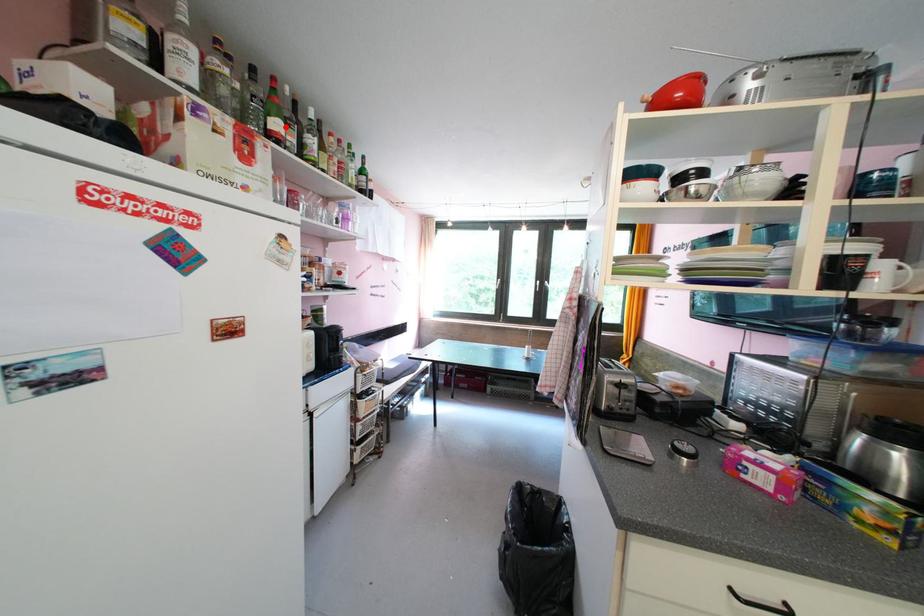
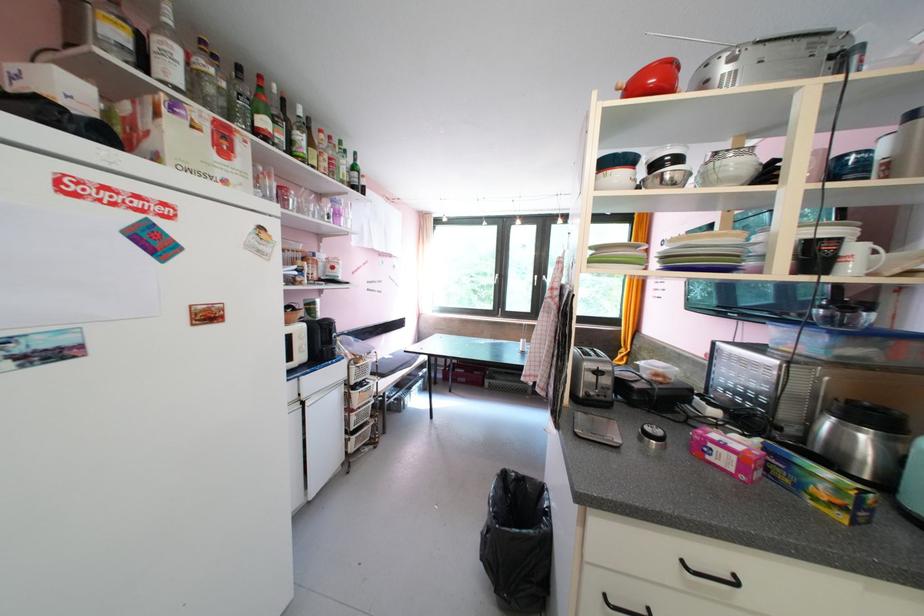
Locate, in the second image, the point that corresponds to the highlighted location in the first image.

(273, 124)